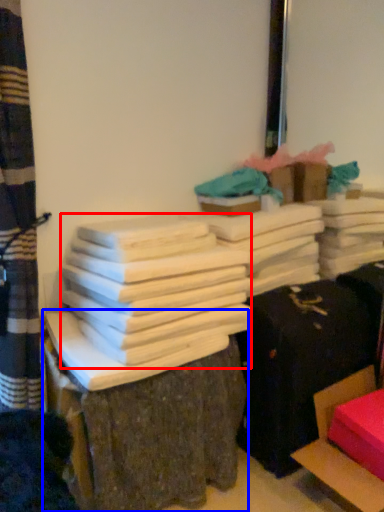
Question: Which of the following is the farthest to the observer, bundle (highlighted by a red box) or furniture (highlighted by a blue box)?

Choices:
 (A) bundle
 (B) furniture

Answer: (A)